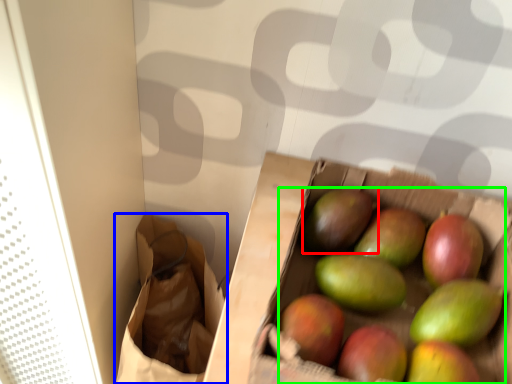
Question: Which is nearer to the mango (highlighted by a red box)? shopping bag (highlighted by a blue box) or grapefruit (highlighted by a green box).

Choices:
 (A) shopping bag
 (B) grapefruit

Answer: (B)